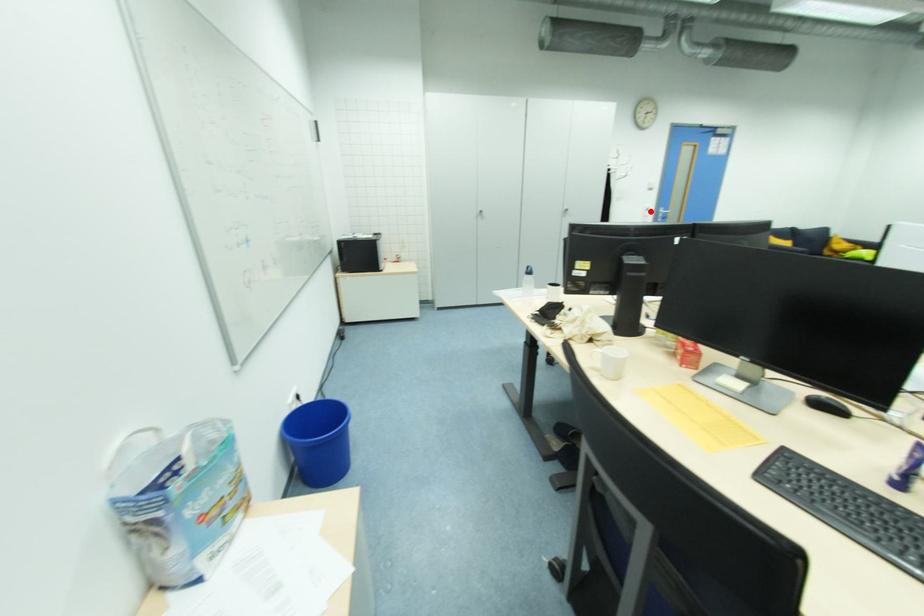
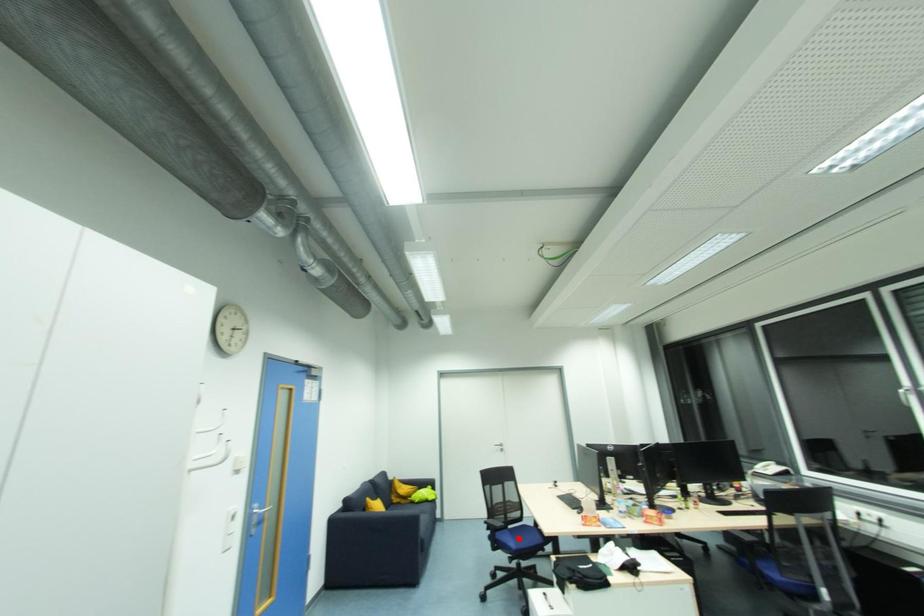
I am providing you with two images of the same scene from different viewpoints. A red point is marked on the first image and another point is marked on the second image. Is the marked point in image1 the same physical position as the marked point in image2?

No